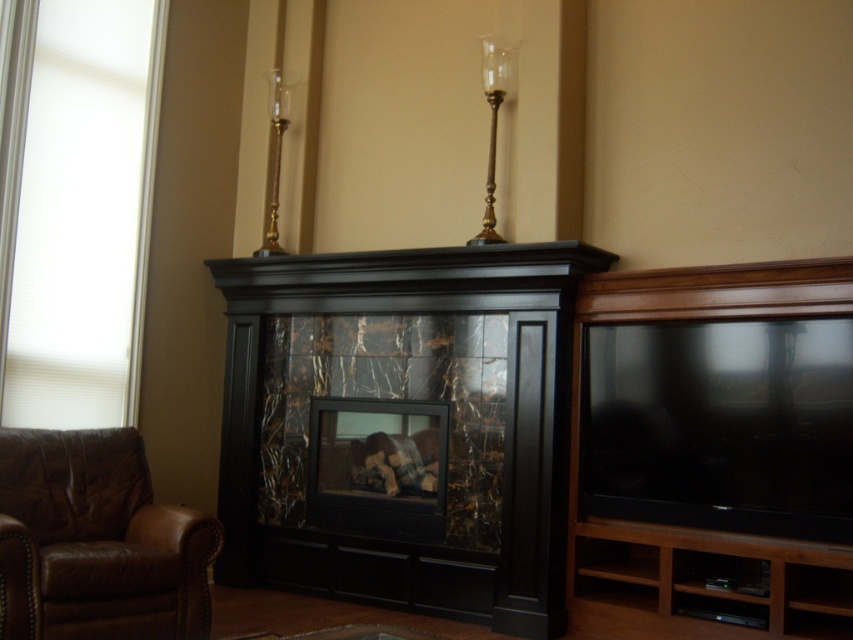
Question: Which object appears farthest from the camera in this image?

Choices:
 (A) brown leather armchair at lower left
 (B) black marble fireplace at center

Answer: (B)

Question: In this image, where is black marble fireplace at center located relative to brown leather armchair at lower left?

Choices:
 (A) right
 (B) left

Answer: (A)

Question: Does black marble fireplace at center appear over brown leather armchair at lower left?

Choices:
 (A) yes
 (B) no

Answer: (A)

Question: Among these points, which one is nearest to the camera?

Choices:
 (A) (19, 536)
 (B) (364, 580)

Answer: (A)

Question: Can you confirm if black marble fireplace at center is thinner than brown leather armchair at lower left?

Choices:
 (A) yes
 (B) no

Answer: (B)

Question: Which point is closer to the camera?

Choices:
 (A) (9, 634)
 (B) (405, 266)

Answer: (A)